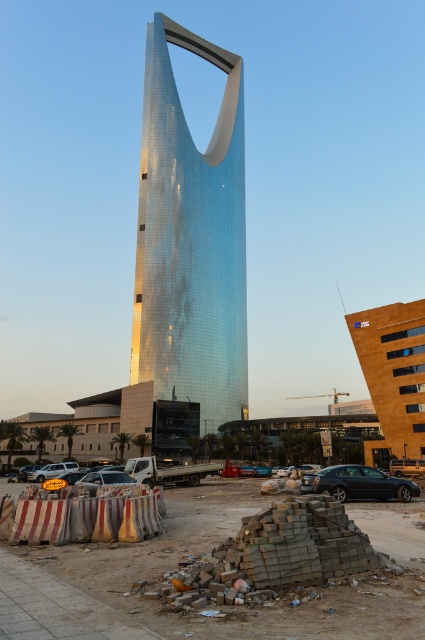
You are a delivery driver needing to park your silver metallic suv at lower left near the glossy metallic tower at center. Given that your parking spot must be within 100 meters, will you be able to park there?

The distance between the glossy metallic tower at center and the silver metallic suv at lower left is 134.71 meters, which exceeds the 100 meter requirement. Therefore, you cannot park the silver metallic suv at lower left within the required distance of the glossy metallic tower at center.

You are a construction worker who needs to place a new flagpole that is 10 meters tall. You have two options for placement locations near the glossy metallic tower at center and the brown brick pile at center. Based on their heights, which location would allow the flagpole to be visible above both structures?

The glossy metallic tower at center is taller than the brown brick pile at center. Therefore, placing the flagpole near the brown brick pile at center would allow it to be visible above both structures since the flagpole is taller than the brown brick pile, but shorter than the glossy metallic tower. However, since the tower is taller, the flagpole might still be partially obscured if placed near it. To ensure full visibility, placing it near the brown brick pile at center is better.

You are a drone operator tasked with capturing aerial footage of the glossy metallic tower at center. Your drone has a maximum flight range of 120 meters. Can you safely fly your drone from your current position to the tower and back without exceeding the drone range limit?

The distance between the glossy metallic tower at center and the camera is 115.34 meters. Since the drone can fly up to 120 meters, the round trip distance would be 230.68 meters. However, the drone can only fly 120 meters one way, so the total round trip would exceed the maximum range. Therefore, the drone cannot safely fly to the tower and return without exceeding the range limit.